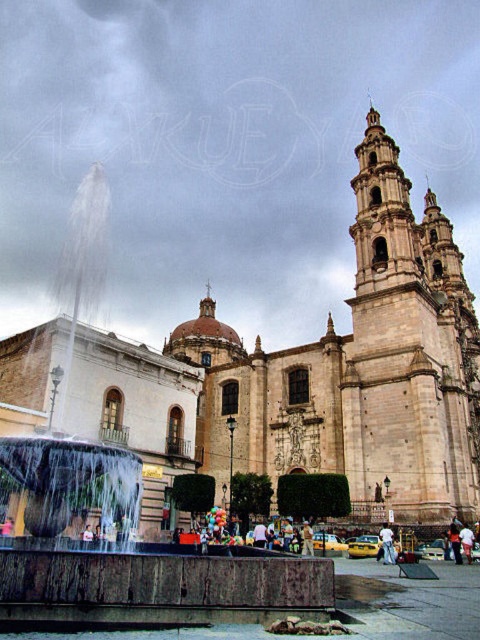
In the scene shown: You are standing in the square in front of the beige stone church at center and the light blue jeans at center. Which object is closer to you?

The beige stone church at center is closer to you than the light blue jeans at center because it is further to the viewer.